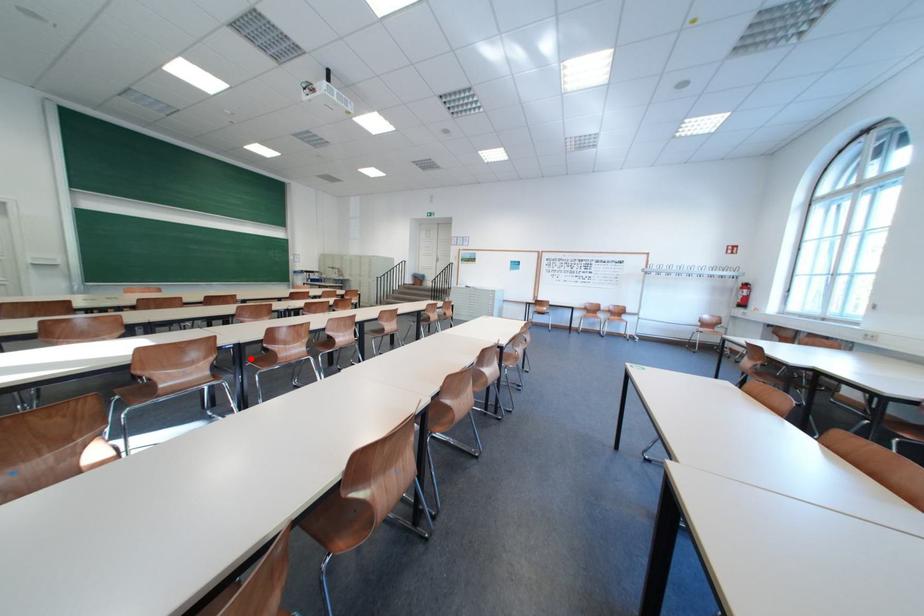
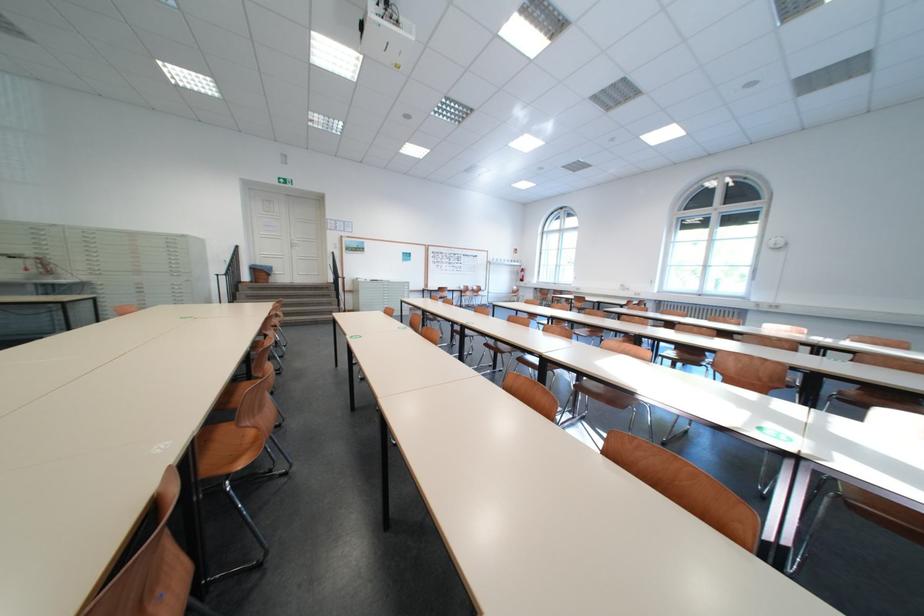
Question: I am providing you with two images of the same scene from different viewpoints. A red point is marked on the first image. Is the red point's position out of view in image 2?

Choices:
 (A) Yes
 (B) No

Answer: (A)